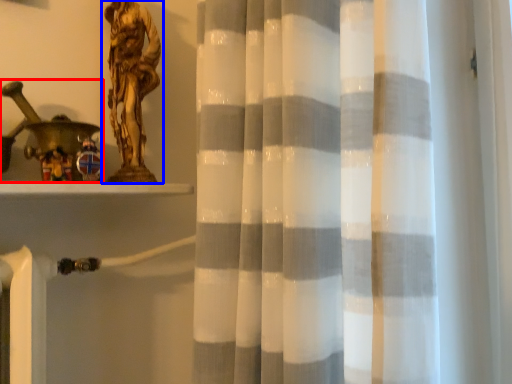
Question: Which of the following is the farthest to the observer, toy (highlighted by a red box) or sculpture (highlighted by a blue box)?

Choices:
 (A) toy
 (B) sculpture

Answer: (B)